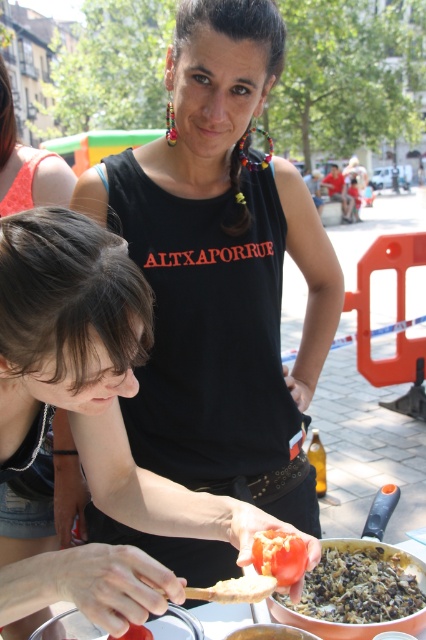
What do you see at coordinates (357, 586) in the screenshot? The height and width of the screenshot is (640, 426). I see `dark brown textured rice at lower right` at bounding box center [357, 586].

Between dark brown textured rice at lower right and red matte tomato at lower center, which one appears on the left side from the viewer's perspective?

From the viewer's perspective, red matte tomato at lower center appears more on the left side.

The height and width of the screenshot is (640, 426). What do you see at coordinates (357, 586) in the screenshot? I see `dark brown textured rice at lower right` at bounding box center [357, 586].

Where is `dark brown textured rice at lower right`? This screenshot has height=640, width=426. dark brown textured rice at lower right is located at coordinates (357, 586).

Is black matte tank top at center thinner than dark brown textured rice at lower right?

In fact, black matte tank top at center might be wider than dark brown textured rice at lower right.

Between black matte tank top at center and dark brown textured rice at lower right, which one has more height?

black matte tank top at center

Which is behind, point (261, 420) or point (334, 620)?

Point (261, 420)

This screenshot has height=640, width=426. I want to click on black matte tank top at center, so click(221, 269).

Who is positioned more to the right, black matte tank top at center or red matte tomato at lower center?

Positioned to the right is red matte tomato at lower center.

Describe the element at coordinates (221, 269) in the screenshot. This screenshot has width=426, height=640. I see `black matte tank top at center` at that location.

Identify the location of black matte tank top at center. tap(221, 269).